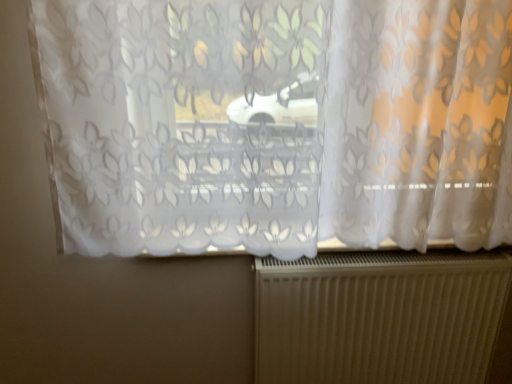
Question: From a real-world perspective, is metallic ribbed radiator at bottom physically located above or below translucent floral-patterned curtain at center?

Choices:
 (A) above
 (B) below

Answer: (B)

Question: Is metallic ribbed radiator at bottom to the left or to the right of translucent floral-patterned curtain at center in the image?

Choices:
 (A) left
 (B) right

Answer: (B)

Question: Considering the positions of metallic ribbed radiator at bottom and translucent floral-patterned curtain at center in the image, is metallic ribbed radiator at bottom wider or thinner than translucent floral-patterned curtain at center?

Choices:
 (A) thin
 (B) wide

Answer: (A)

Question: Considering the positions of translucent floral-patterned curtain at center and metallic ribbed radiator at bottom in the image, is translucent floral-patterned curtain at center wider or thinner than metallic ribbed radiator at bottom?

Choices:
 (A) wide
 (B) thin

Answer: (A)

Question: In terms of size, does translucent floral-patterned curtain at center appear bigger or smaller than metallic ribbed radiator at bottom?

Choices:
 (A) small
 (B) big

Answer: (B)

Question: From their relative heights in the image, would you say translucent floral-patterned curtain at center is taller or shorter than metallic ribbed radiator at bottom?

Choices:
 (A) tall
 (B) short

Answer: (A)

Question: In the image, is translucent floral-patterned curtain at center positioned in front of or behind metallic ribbed radiator at bottom?

Choices:
 (A) front
 (B) behind

Answer: (A)